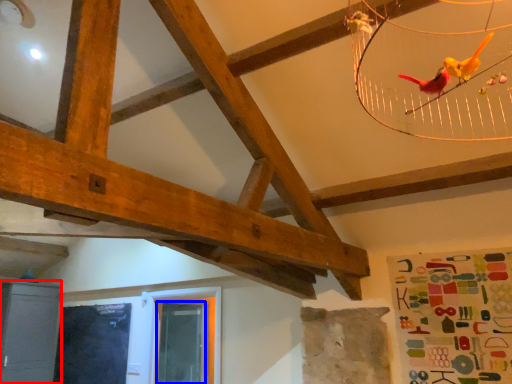
Question: Which point is further to the camera, furniture (highlighted by a red box) or window screen (highlighted by a blue box)?

Choices:
 (A) furniture
 (B) window screen

Answer: (B)